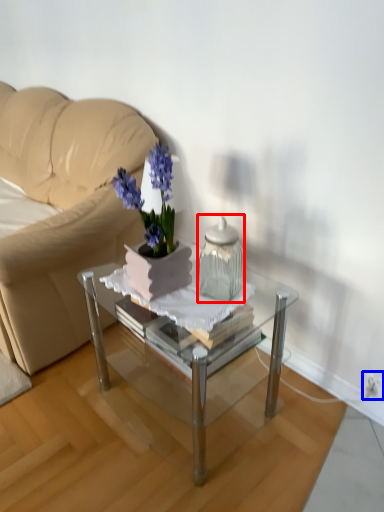
Question: Which of the following is the closest to the observer, vase (highlighted by a red box) or electric outlet (highlighted by a blue box)?

Choices:
 (A) vase
 (B) electric outlet

Answer: (A)